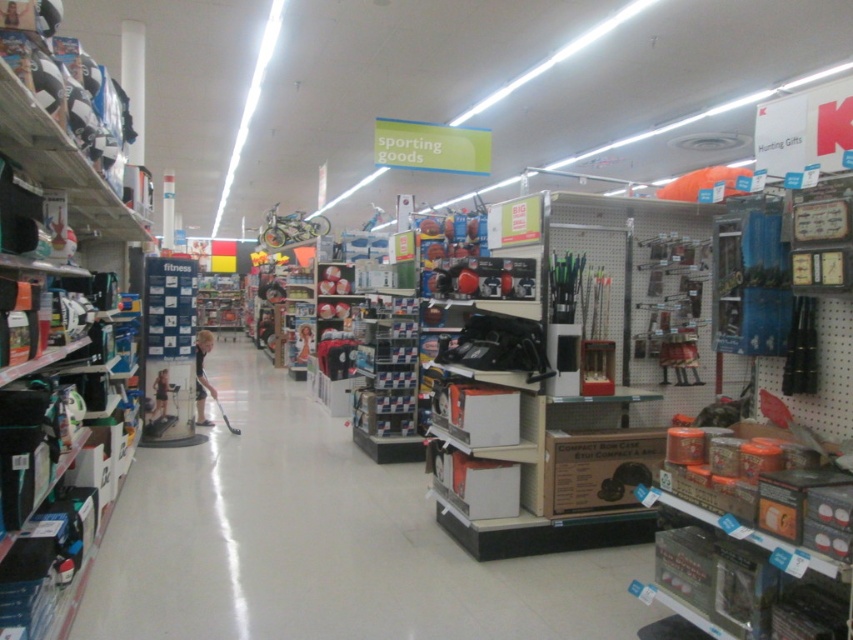
You are standing in the retail store and see a point marked at coordinates (57,301). What object is located at that point?

The point at coordinates (57,301) indicates white plastic shelves at left.

You are a store employee who needs to determine if the matte black hockey stick at center can fit into a storage box designed for the dark blue shirt at center. Based on their sizes, will it fit?

The matte black hockey stick at center has a smaller size compared to the dark blue shirt at center, so it should fit into the storage box designed for the dark blue shirt at center.

You are standing at the entrance of the store and want to find the white plastic shelves at left. Based on their coordinates, are they closer to the front or the back of the store?

→ The white plastic shelves at left are located at point (57, 301), which means they are closer to the front of the store since the y coordinate is lower.